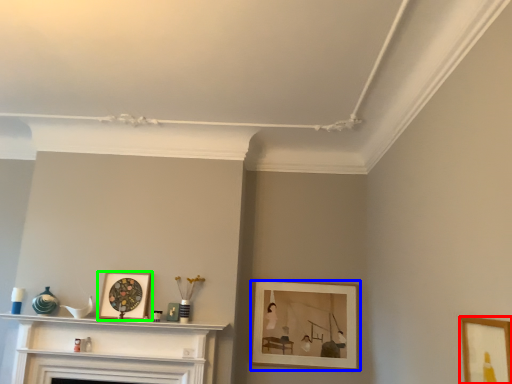
Question: Based on their relative distances, which object is nearer to picture frame (highlighted by a red box)? Choose from picture frame (highlighted by a blue box) and picture frame (highlighted by a green box).

Choices:
 (A) picture frame
 (B) picture frame

Answer: (A)